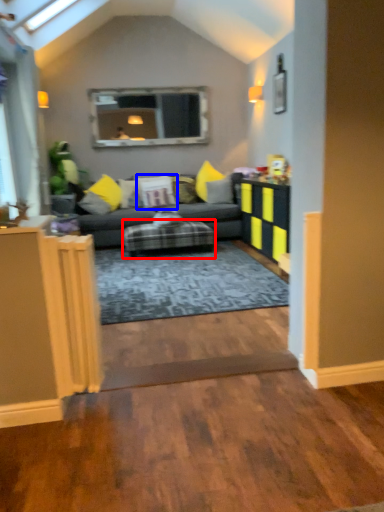
Question: Which object appears closest to the camera in this image, furniture (highlighted by a red box) or pillow (highlighted by a blue box)?

Choices:
 (A) furniture
 (B) pillow

Answer: (A)